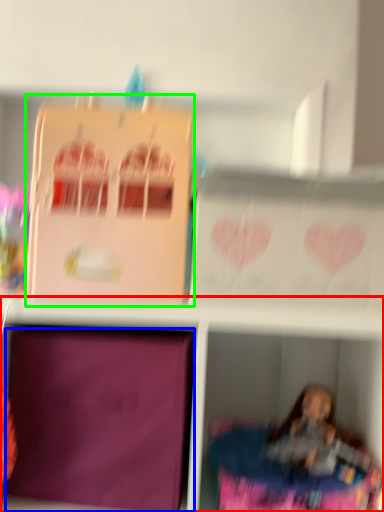
Question: Based on their relative distances, which object is farther from shelf (highlighted by a red box)? Choose from cardboard box (highlighted by a blue box) and cardboard box (highlighted by a green box).

Choices:
 (A) cardboard box
 (B) cardboard box

Answer: (B)